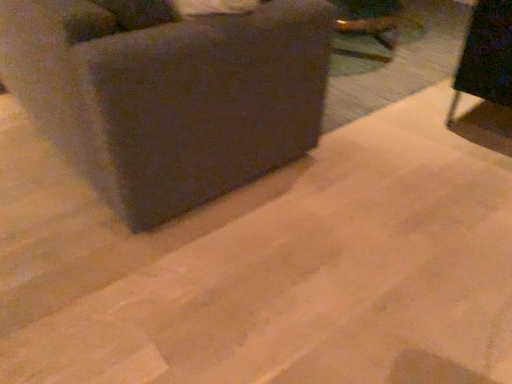
Question: Would you say black fabric chair at upper right, positioned as the 2th furniture in left-to-right order, is to the left or to the right of dark fabric couch at upper left, placed as the 2th furniture when sorted from right to left, in the picture?

Choices:
 (A) left
 (B) right

Answer: (B)

Question: Is black fabric chair at upper right, the first furniture from the right, inside the boundaries of dark fabric couch at upper left, the 1th furniture from the left, or outside?

Choices:
 (A) outside
 (B) inside

Answer: (A)

Question: Is point (496, 84) positioned closer to the camera than point (214, 147)?

Choices:
 (A) closer
 (B) farther

Answer: (B)

Question: From the image's perspective, relative to black fabric chair at upper right, positioned as the 2th furniture in left-to-right order, is dark fabric couch at upper left, the 1th furniture from the left, above or below?

Choices:
 (A) above
 (B) below

Answer: (A)

Question: Is dark fabric couch at upper left, placed as the 2th furniture when sorted from right to left, wider or thinner than black fabric chair at upper right, the first furniture from the right?

Choices:
 (A) wide
 (B) thin

Answer: (A)

Question: From a real-world perspective, relative to black fabric chair at upper right, the first furniture from the right, is dark fabric couch at upper left, the 1th furniture from the left, vertically above or below?

Choices:
 (A) below
 (B) above

Answer: (B)

Question: In terms of height, does dark fabric couch at upper left, the 1th furniture from the left, look taller or shorter compared to black fabric chair at upper right, the first furniture from the right?

Choices:
 (A) tall
 (B) short

Answer: (A)